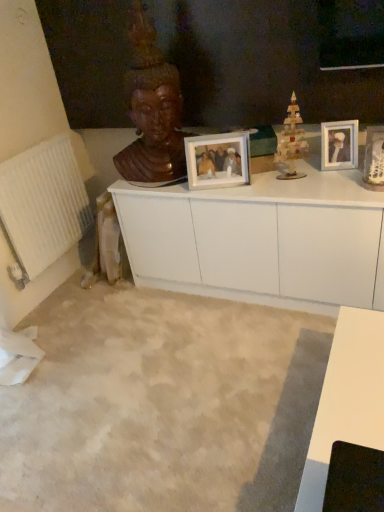
Where is `blank area to the left of wooden toy at center`? This screenshot has height=512, width=384. blank area to the left of wooden toy at center is located at coordinates (260, 184).